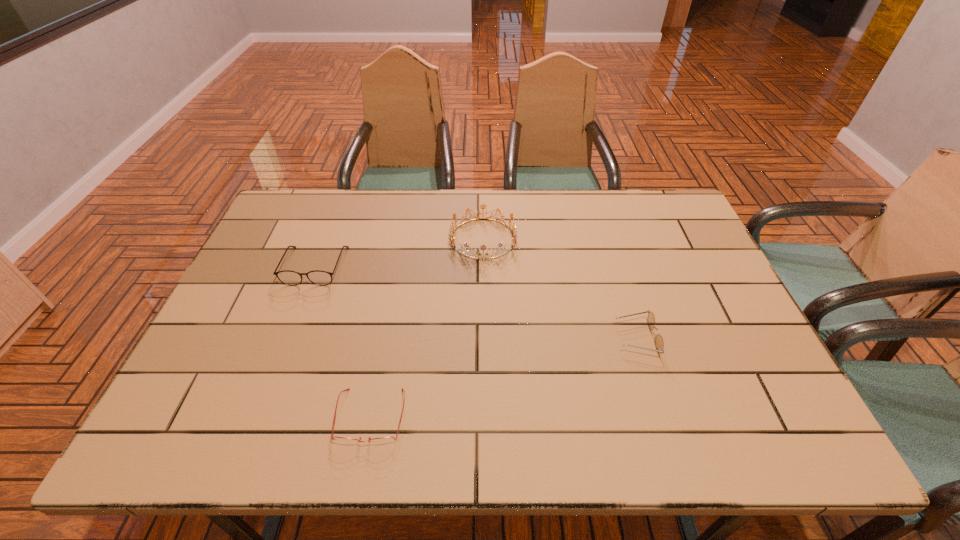
The height and width of the screenshot is (540, 960). I want to click on the second object from right to left, so click(x=514, y=232).

Locate an element on the screen. The width and height of the screenshot is (960, 540). the tallest object is located at coordinates (514, 232).

I want to click on the farthest spectacles, so click(x=292, y=278).

The image size is (960, 540). Identify the location of the third shortest object. (292, 278).

Where is `the second farthest spectacles`? The height and width of the screenshot is (540, 960). the second farthest spectacles is located at coordinates (659, 344).

Identify the location of the second tallest spectacles. This screenshot has height=540, width=960. (659, 344).

Locate an element on the screen. This screenshot has height=540, width=960. the nearest object is located at coordinates (384, 440).

Identify the location of the shortest object. (384, 440).

Find the location of `free space located on the front-facing side of the third object from left to right`. free space located on the front-facing side of the third object from left to right is located at coordinates (484, 332).

Find the location of `free space located on the front-facing side of the tallest spectacles`. free space located on the front-facing side of the tallest spectacles is located at coordinates (301, 302).